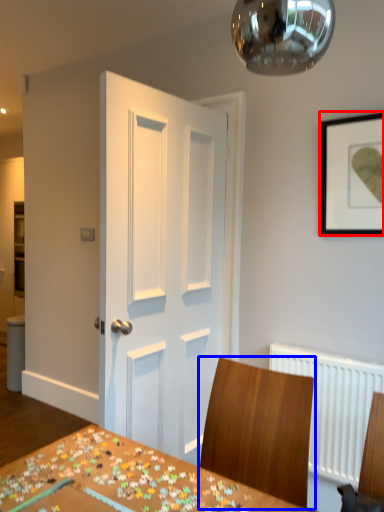
Question: Which of the following is the closest to the observer, picture frame (highlighted by a red box) or chair (highlighted by a blue box)?

Choices:
 (A) picture frame
 (B) chair

Answer: (B)